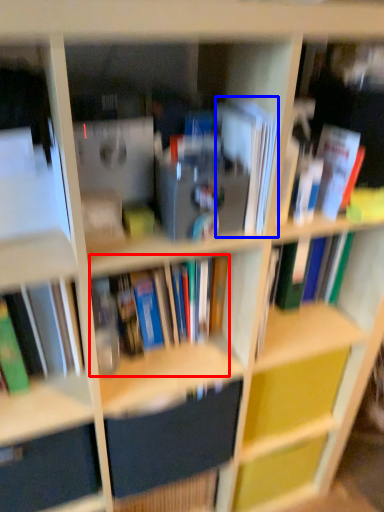
Question: Which point is further to the camera, book (highlighted by a red box) or paperback book (highlighted by a blue box)?

Choices:
 (A) book
 (B) paperback book

Answer: (A)